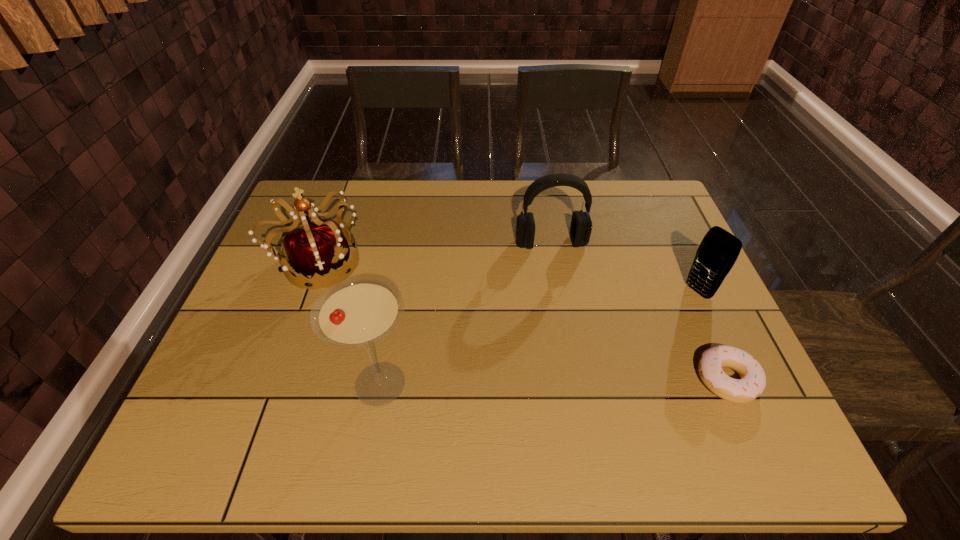
I want to click on martini, so click(x=356, y=312).

Locate an element on the screen. The image size is (960, 540). doughnut is located at coordinates point(752,382).

The width and height of the screenshot is (960, 540). What are the coordinates of `tiara` in the screenshot? It's located at (319, 248).

Where is `cellular telephone`? The height and width of the screenshot is (540, 960). cellular telephone is located at coordinates (718, 251).

The width and height of the screenshot is (960, 540). I want to click on the third object from left to right, so click(x=581, y=225).

Image resolution: width=960 pixels, height=540 pixels. In order to click on free spot located on the back of the second object from left to right in this screenshot , I will do `click(405, 241)`.

The image size is (960, 540). I want to click on vacant space located on the back of the shortest object, so click(x=703, y=323).

Identify the location of blank space located on the front-facing side of the leftmost object. The image size is (960, 540). (422, 316).

Where is `vacant position located 0.090m on the front-facing side of the leftmost object`? The height and width of the screenshot is (540, 960). vacant position located 0.090m on the front-facing side of the leftmost object is located at coordinates (376, 292).

Where is `free region located on the front-facing side of the leftmost object`? The width and height of the screenshot is (960, 540). free region located on the front-facing side of the leftmost object is located at coordinates (442, 326).